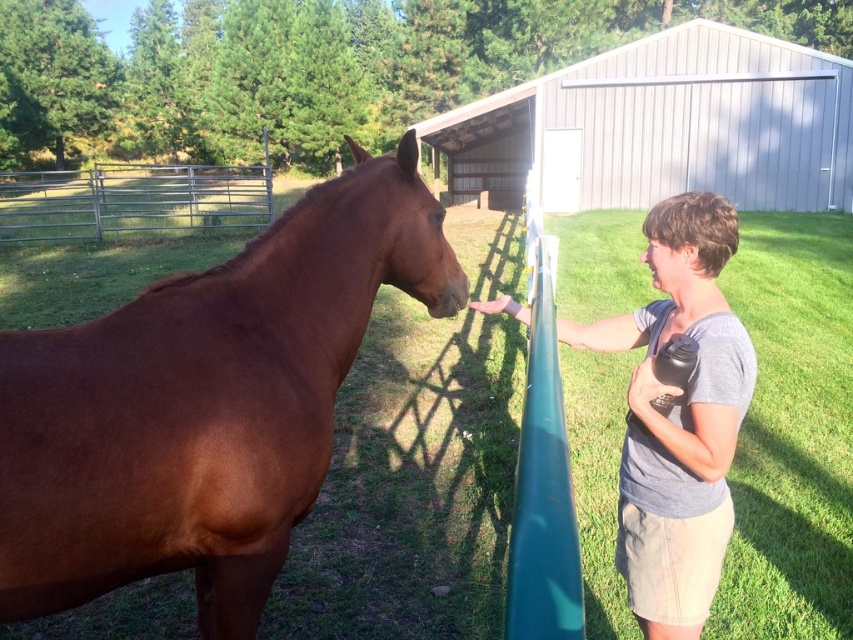
Who is taller, brown glossy horse at left or metallic silver fence at upper left?

metallic silver fence at upper left

Does point (294, 436) come closer to viewer compared to point (192, 164)?

That is True.

Locate an element on the screen. This screenshot has height=640, width=853. brown glossy horse at left is located at coordinates (206, 403).

Is point (337, 182) closer to camera compared to point (666, 248)?

No, (337, 182) is behind (666, 248).

Is brown glossy horse at left shorter than gray cotton shirt at center?

No, brown glossy horse at left is not shorter than gray cotton shirt at center.

Measure the distance between point (310,316) and camera.

Point (310,316) is 2.33 meters away from camera.

At what (x,y) coordinates should I click in order to perform the action: click on brown glossy horse at left. Please return your answer as a coordinate pair (x, y). Looking at the image, I should click on (206, 403).

Can you confirm if gray cotton shirt at center is positioned below metallic silver fence at upper left?

Yes, gray cotton shirt at center is below metallic silver fence at upper left.

Does point (694, 385) come behind point (238, 211)?

That is False.

In order to click on gray cotton shirt at center in this screenshot , I will do `click(677, 417)`.